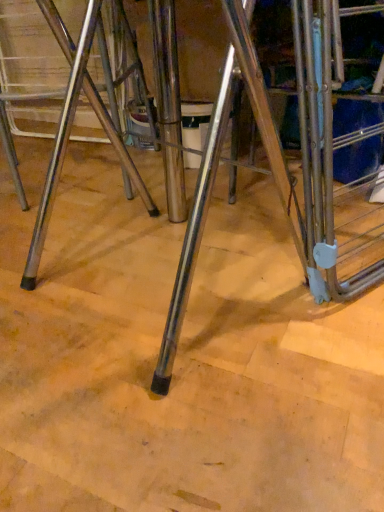
This screenshot has height=512, width=384. Find the location of `vacant space behind silver metallic ladder at center`. vacant space behind silver metallic ladder at center is located at coordinates (278, 203).